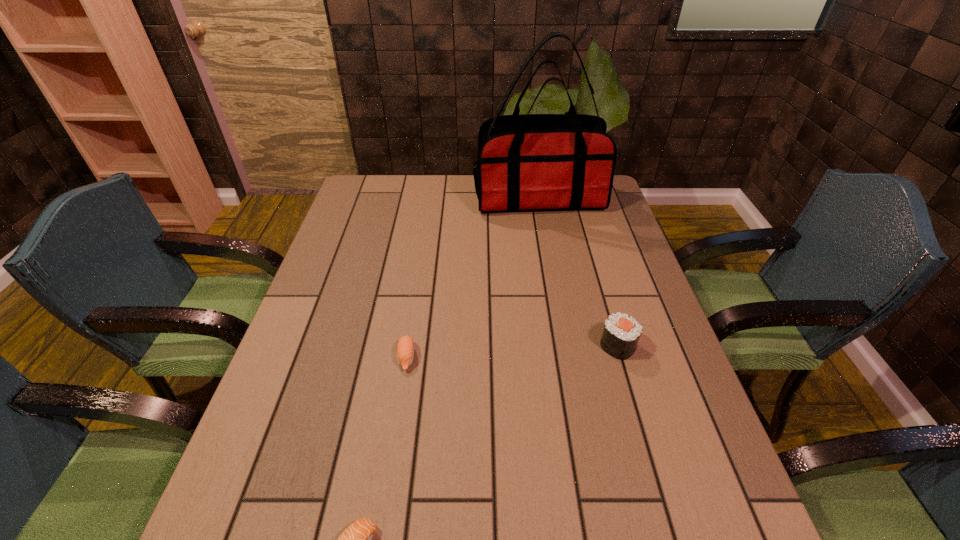
Locate an element on the screen. The width and height of the screenshot is (960, 540). the tallest object is located at coordinates (532, 161).

You are a GUI agent. You are given a task and a screenshot of the screen. Output one action in this format:
    pyautogui.click(x=<x>, y=<y>)
    Task: Click on the farthest object
    
    Given the screenshot: What is the action you would take?
    point(532,161)

Where is `the third shortest object`? The image size is (960, 540). the third shortest object is located at coordinates (621, 334).

What are the coordinates of `the tallest sushi` in the screenshot? It's located at (621, 334).

This screenshot has width=960, height=540. Identify the location of the second shortest sushi. (405, 349).

Identify the location of vacant space located 0.390m on the left of the tallest object. tap(360, 199).

The width and height of the screenshot is (960, 540). Identify the location of free spot located on the front of the tallest sushi. (628, 382).

Where is `free space located 0.070m on the back of the second tallest sushi`? The height and width of the screenshot is (540, 960). free space located 0.070m on the back of the second tallest sushi is located at coordinates tap(412, 320).

In order to click on object at the far edge in this screenshot , I will do `click(532, 161)`.

Locate an element on the screen. This screenshot has height=540, width=960. duffel bag that is at the right edge is located at coordinates (532, 161).